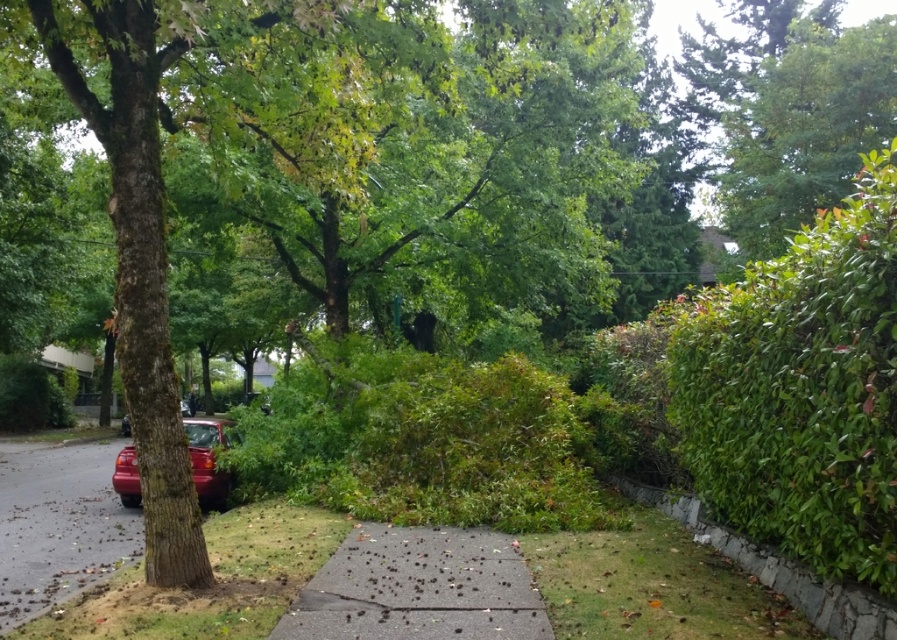
Can you confirm if green leafy hedge at right is positioned to the right of shiny red car at left?

Yes, green leafy hedge at right is to the right of shiny red car at left.

Is point (717, 429) closer to viewer compared to point (122, 467)?

Yes, point (717, 429) is in front of point (122, 467).

Where is `green leafy hedge at right`? The height and width of the screenshot is (640, 897). green leafy hedge at right is located at coordinates (800, 388).

Can you confirm if green leafy hedge at right is bigger than smooth asphalt road at lower left?

Incorrect, green leafy hedge at right is not larger than smooth asphalt road at lower left.

Is green leafy hedge at right positioned before smooth asphalt road at lower left?

Yes.

Describe the element at coordinates (800, 388) in the screenshot. I see `green leafy hedge at right` at that location.

The height and width of the screenshot is (640, 897). Identify the location of green leafy hedge at right. (800, 388).

Based on the photo, between smooth asphalt road at lower left and shiny red car at left, which one appears on the right side from the viewer's perspective?

From the viewer's perspective, shiny red car at left appears more on the right side.

Locate an element on the screen. The width and height of the screenshot is (897, 640). smooth asphalt road at lower left is located at coordinates (59, 524).

Is point (35, 461) less distant than point (222, 448)?

No, (35, 461) is further to viewer.

Where is `smooth asphalt road at lower left`? Image resolution: width=897 pixels, height=640 pixels. smooth asphalt road at lower left is located at coordinates (59, 524).